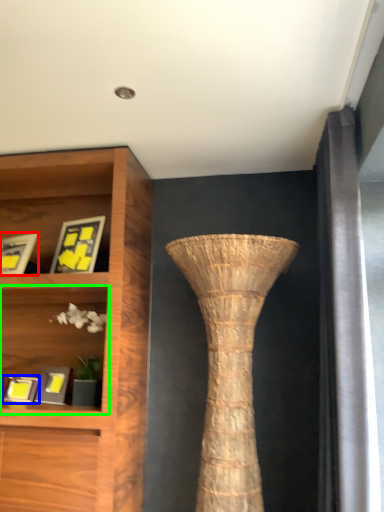
Question: Which object is the closest to the picture frame (highlighted by a red box)? Choose among these: picture frame (highlighted by a blue box) or shelf (highlighted by a green box).

Choices:
 (A) picture frame
 (B) shelf

Answer: (B)